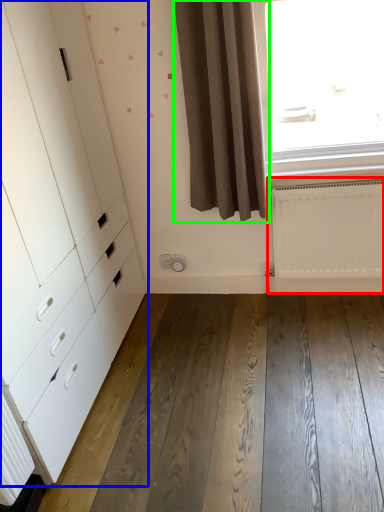
Question: Which object is the farthest from radiator (highlighted by a red box)? Choose among these: chest of drawers (highlighted by a blue box) or curtain (highlighted by a green box).

Choices:
 (A) chest of drawers
 (B) curtain

Answer: (A)